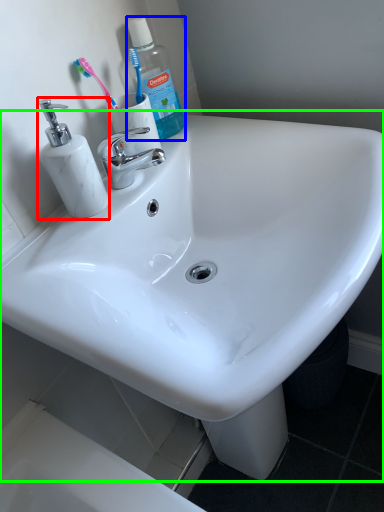
Question: Which is farther away from soap dispenser (highlighted by a red box)? cleaning product (highlighted by a blue box) or sink (highlighted by a green box)?

Choices:
 (A) cleaning product
 (B) sink

Answer: (B)